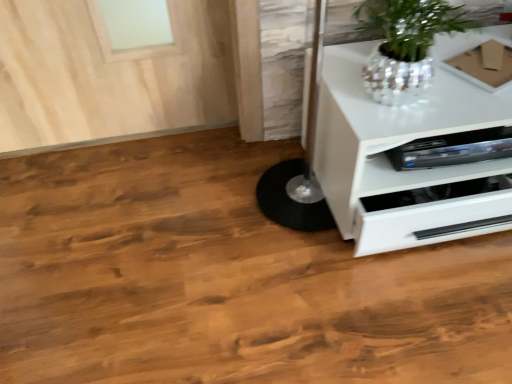
Where is `space that is in front of brown cardboard box at upper right`? This screenshot has width=512, height=384. space that is in front of brown cardboard box at upper right is located at coordinates (480, 102).